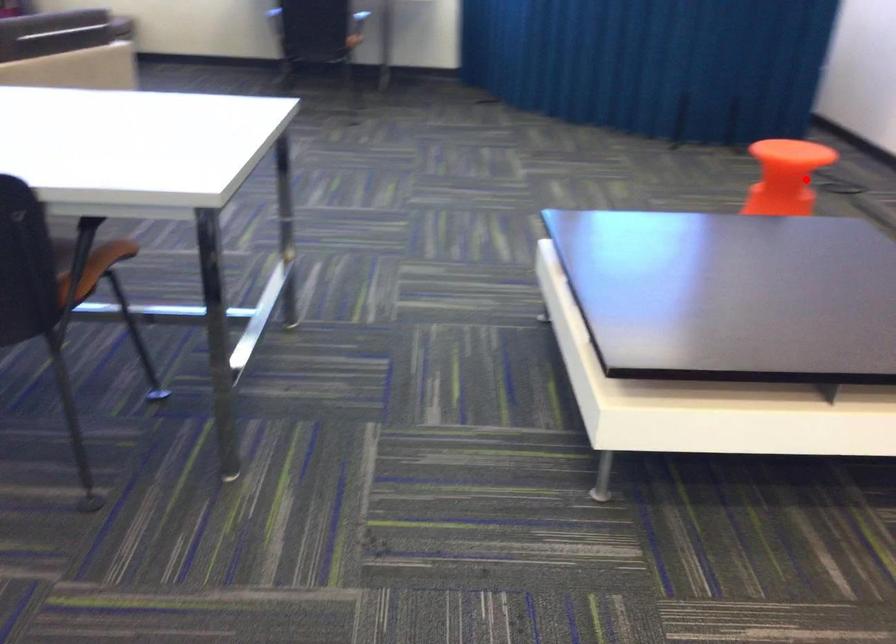
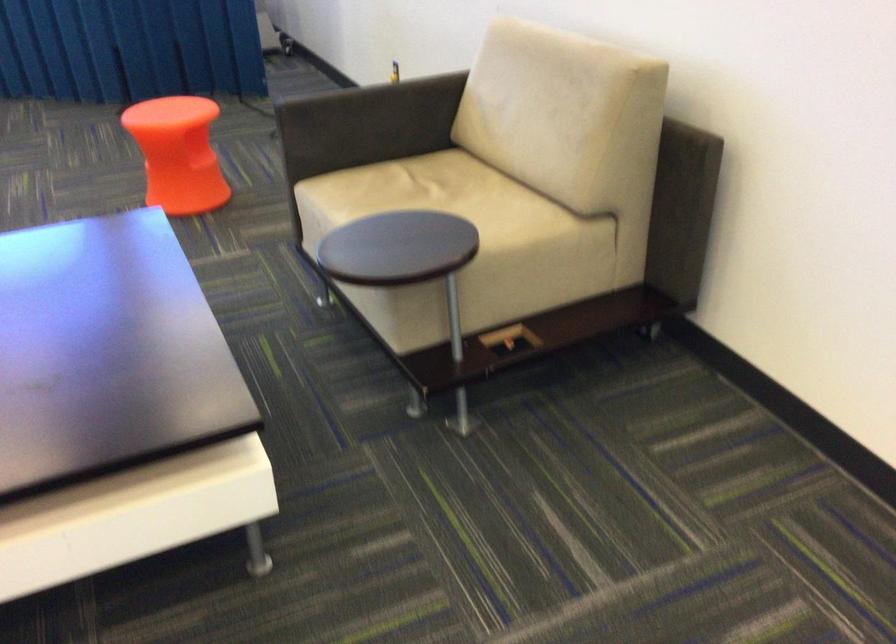
Question: I am providing you with two images of the same scene from different viewpoints. In image1, a red point is highlighted. Considering the same 3D point in image2, which of the following is correct?

Choices:
 (A) It is closer
 (B) It is farther

Answer: (A)